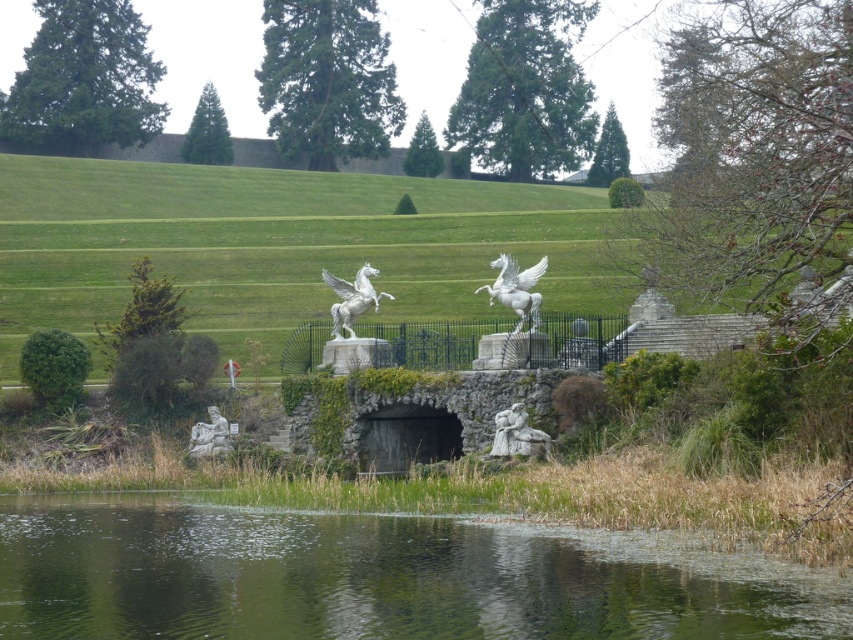
From the picture: You are a park visitor who wants to take a photo of both the white stone hillside at center and the white stone statue at lower left. Which object should you stand closer to in order to capture both in a single frame without zooming in?

You should stand closer to the white stone statue at lower left because the white stone hillside at center is larger and will appear smaller from a distance, allowing both to fit in the frame.

You are a photographer planning to capture a symmetrical composition of the white marble horse at center and the white stone statue at lower left. Since you want both subjects to appear balanced in size within the frame, which one should you position closer to the camera?

The white marble horse at center is taller than the white stone statue at lower left, so to balance their sizes in the photo, you should position the white marble horse at center farther from the camera and the white stone statue at lower left closer to the camera.

You are standing at the edge of the pond in the park. You see a point marked at coordinates (517, 289). What object is located at that point?

The point at coordinates (517, 289) corresponds to the white marble horse at center.